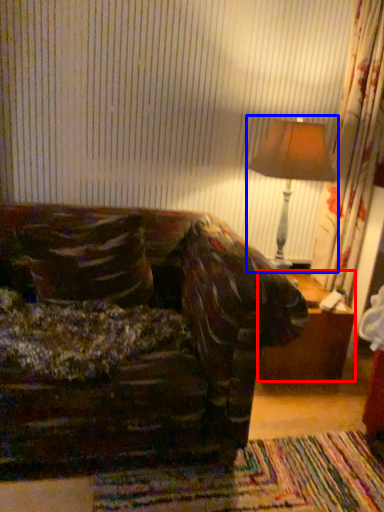
Question: Which point is closer to the camera, table (highlighted by a red box) or table lamp (highlighted by a blue box)?

Choices:
 (A) table
 (B) table lamp

Answer: (B)